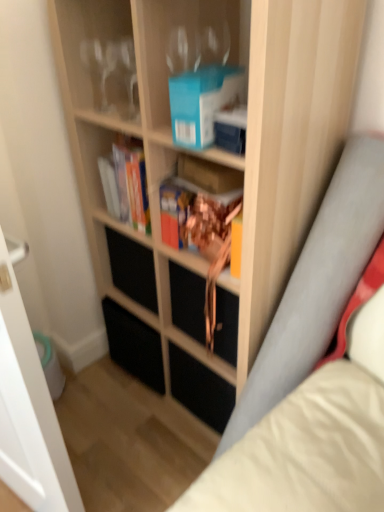
Question: Considering the relative sizes of black matte drawer at center and hardcover book at center, the second book from the right, in the image provided, is black matte drawer at center smaller than hardcover book at center, the second book from the right,?

Choices:
 (A) no
 (B) yes

Answer: (A)

Question: Does black matte drawer at center appear on the left side of hardcover book at center, the second book from the right?

Choices:
 (A) yes
 (B) no

Answer: (B)

Question: Is black matte drawer at center looking in the opposite direction of hardcover book at center, which is the first book from back to front?

Choices:
 (A) no
 (B) yes

Answer: (A)

Question: Considering the relative positions of black matte drawer at center and hardcover book at center, which appears as the second book when viewed from the front, in the image provided, is black matte drawer at center behind hardcover book at center, which appears as the second book when viewed from the front,?

Choices:
 (A) yes
 (B) no

Answer: (A)

Question: Does black matte drawer at center have a larger size compared to hardcover book at center, the second book from the right?

Choices:
 (A) no
 (B) yes

Answer: (B)

Question: Do you think blue matte paperback book at upper center is within hardcover book at center, which is the first book from back to front, or outside of it?

Choices:
 (A) inside
 (B) outside

Answer: (B)

Question: From the image's perspective, is blue matte paperback book at upper center above or below hardcover book at center, placed as the 1th book when sorted from left to right?

Choices:
 (A) below
 (B) above

Answer: (B)

Question: From their relative heights in the image, would you say blue matte paperback book at upper center is taller or shorter than hardcover book at center, the second book from the right?

Choices:
 (A) short
 (B) tall

Answer: (A)

Question: Is point (187, 74) closer or farther from the camera than point (119, 184)?

Choices:
 (A) farther
 (B) closer

Answer: (B)

Question: Considering the positions of clear glass wine glasses at upper left and black matte drawer at center in the image, is clear glass wine glasses at upper left wider or thinner than black matte drawer at center?

Choices:
 (A) wide
 (B) thin

Answer: (B)

Question: Relative to black matte drawer at center, is clear glass wine glasses at upper left in front or behind?

Choices:
 (A) behind
 (B) front

Answer: (B)

Question: Based on their positions, is clear glass wine glasses at upper left located to the left or right of black matte drawer at center?

Choices:
 (A) left
 (B) right

Answer: (A)

Question: In terms of height, does clear glass wine glasses at upper left look taller or shorter compared to black matte drawer at center?

Choices:
 (A) tall
 (B) short

Answer: (B)

Question: From the image's perspective, is wooden bookcase at center above or below transparent glass door at left?

Choices:
 (A) below
 (B) above

Answer: (B)

Question: Relative to transparent glass door at left, is wooden bookcase at center in front or behind?

Choices:
 (A) behind
 (B) front

Answer: (A)